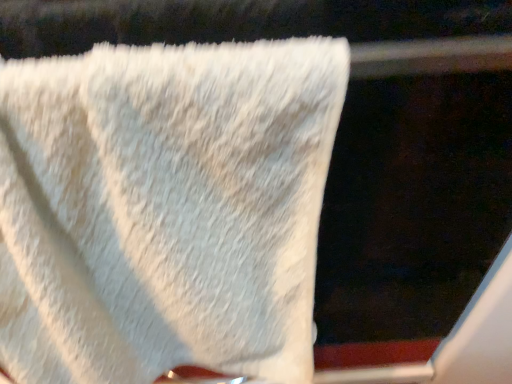
This screenshot has width=512, height=384. I want to click on white fluffy towel at upper left, so click(x=164, y=209).

Describe the element at coordinates (164, 209) in the screenshot. I see `white fluffy towel at upper left` at that location.

This screenshot has width=512, height=384. Find the location of `white fluffy towel at upper left`. white fluffy towel at upper left is located at coordinates (164, 209).